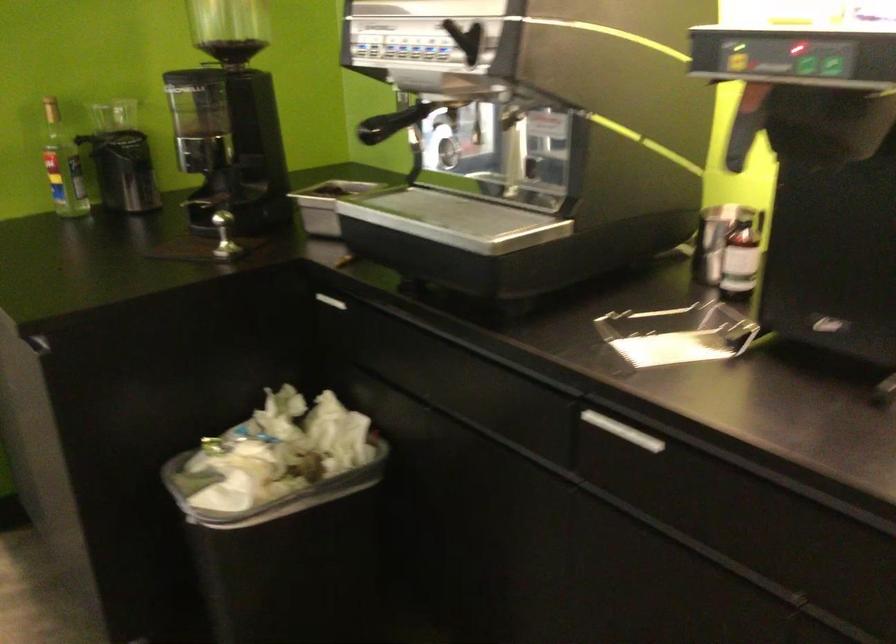
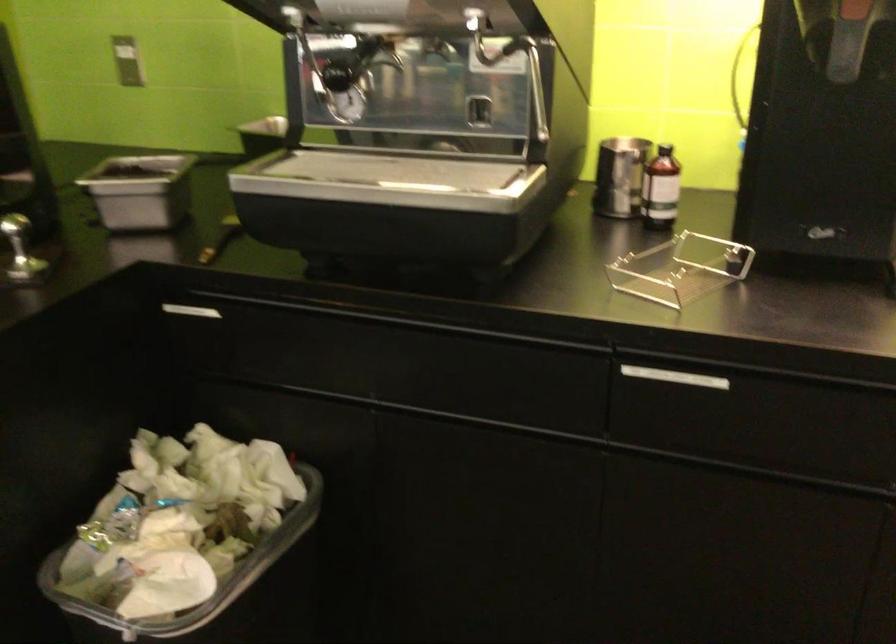
Question: I am providing you with two images of the same scene from different viewpoints. Which of the following objects are not visible in image2?

Choices:
 (A) black bottle cap
 (B) clear plastic holder
 (C) metal machine lever
 (D) none of these

Answer: (D)